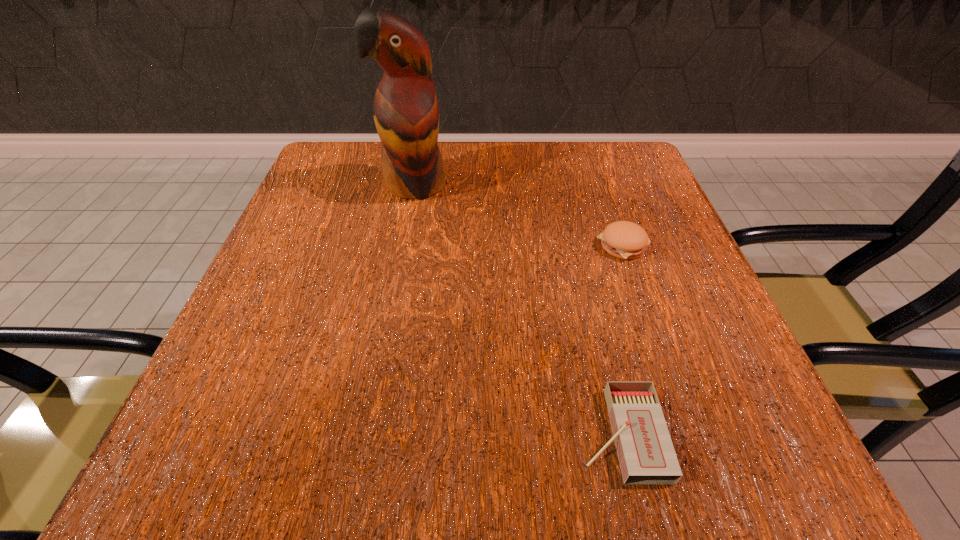
Where is `free space between the matchbox and the tallest object`? Image resolution: width=960 pixels, height=540 pixels. free space between the matchbox and the tallest object is located at coordinates coord(517,309).

Identify which object is the second closest to the nearest object. Please provide its 2D coordinates. Your answer should be formatted as a tuple, i.e. [(x, y)], where the tuple contains the x and y coordinates of a point satisfying the conditions above.

[(406, 113)]

Find the location of a particular element. object that is the closest to the second nearest object is located at coordinates (646, 454).

I want to click on blank area in the image that satisfies the following two spatial constraints: 1. on the face of the second farthest object; 2. on the right side of the tallest object, so click(403, 245).

You are a GUI agent. You are given a task and a screenshot of the screen. Output one action in this format:
    pyautogui.click(x=<x>, y=<y>)
    Task: Click on the vacant space that satisfies the following two spatial constraints: 1. on the front side of the patty; 2. on the striking surface of the matchbox
    The height and width of the screenshot is (540, 960).
    Given the screenshot: What is the action you would take?
    pyautogui.click(x=688, y=434)

Find the location of `free location that satisfies the following two spatial constraints: 1. on the face of the leftmost object; 2. on the left side of the patty`. free location that satisfies the following two spatial constraints: 1. on the face of the leftmost object; 2. on the left side of the patty is located at coordinates (403, 245).

You are a GUI agent. You are given a task and a screenshot of the screen. Output one action in this format:
    pyautogui.click(x=<x>, y=<y>)
    Task: Click on the vacant space that satisfies the following two spatial constraints: 1. on the front side of the second nearest object; 2. on the striking surface of the matchbox
    
    Given the screenshot: What is the action you would take?
    (688, 434)

Locate an element on the screen. The width and height of the screenshot is (960, 540). vacant space that satisfies the following two spatial constraints: 1. on the face of the second nearest object; 2. on the left side of the farthest object is located at coordinates (403, 245).

This screenshot has width=960, height=540. Find the location of `blank space that satisfies the following two spatial constraints: 1. on the face of the patty; 2. on the right side of the farthest object`. blank space that satisfies the following two spatial constraints: 1. on the face of the patty; 2. on the right side of the farthest object is located at coordinates (403, 245).